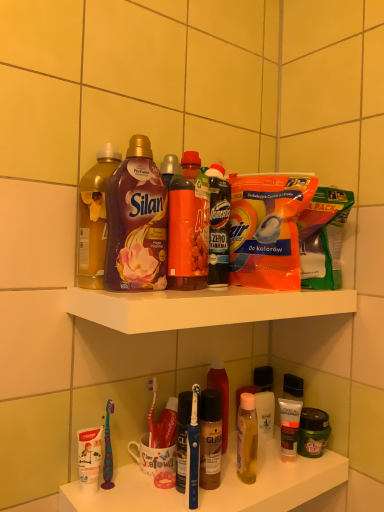
Question: Considering their positions, is matte purple fabric softener at upper center, which is the 1th bottle in left-to-right order, located in front of or behind white plastic toothbrushes at lower left?

Choices:
 (A) behind
 (B) front

Answer: (A)

Question: Looking at the image, does matte purple fabric softener at upper center, arranged as the second bottle when viewed from the back, seem bigger or smaller compared to white plastic toothbrushes at lower left?

Choices:
 (A) small
 (B) big

Answer: (A)

Question: Which of these objects is positioned farthest from the purple glossy liquid at upper center, which appears as the 2th bottle when viewed from the right?

Choices:
 (A) matte black hair mask at lower right, which is the first toiletry from front to back
 (B) matte purple fabric softener at upper center, acting as the second bottle starting from the top
 (C) white plastic toothbrushes at lower left
 (D) white plastic shelf at upper center
 (E) translucent plastic bottle at center, which is the third bottle in left-to-right order

Answer: (A)

Question: Which object is positioned closest to the blue plastic toothbrush at lower center?

Choices:
 (A) matte black tube at lower right, which is the second toiletry from front to back
 (B) white plastic toothbrushes at lower left
 (C) orange plastic packet at upper center
 (D) purple glossy liquid at upper center, the third bottle in the bottom-to-top sequence
 (E) translucent plastic bottle at center, which is counted as the 3th bottle, starting from the front

Answer: (B)